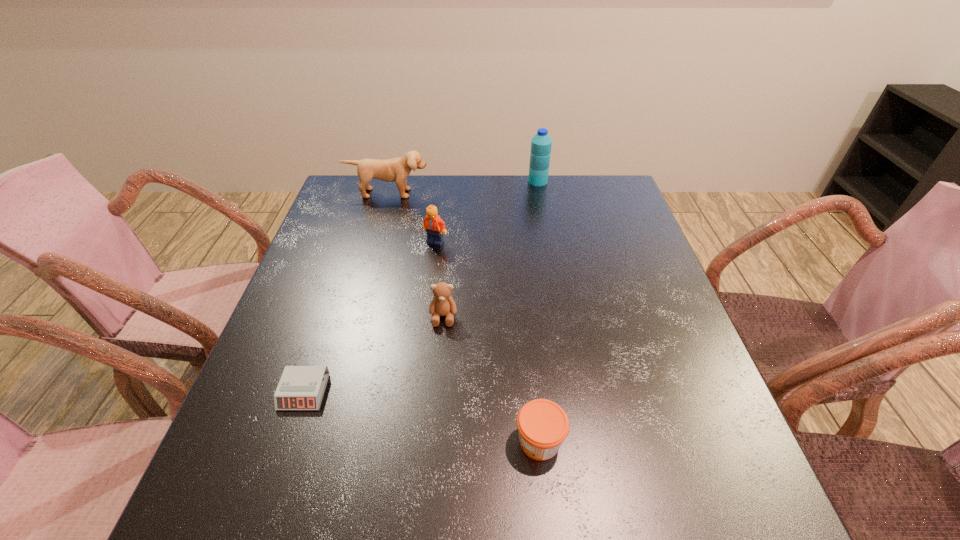
Locate an element on the screen. vacant space in between the nearest object and the alarm clock is located at coordinates (421, 416).

The height and width of the screenshot is (540, 960). In order to click on empty space between the third farthest object and the nearest object in this screenshot , I will do `click(488, 341)`.

Image resolution: width=960 pixels, height=540 pixels. I want to click on object that stands as the fifth closest to the second tallest object, so click(x=542, y=424).

Where is `object that can be found as the third closest to the second tallest object`? object that can be found as the third closest to the second tallest object is located at coordinates (442, 304).